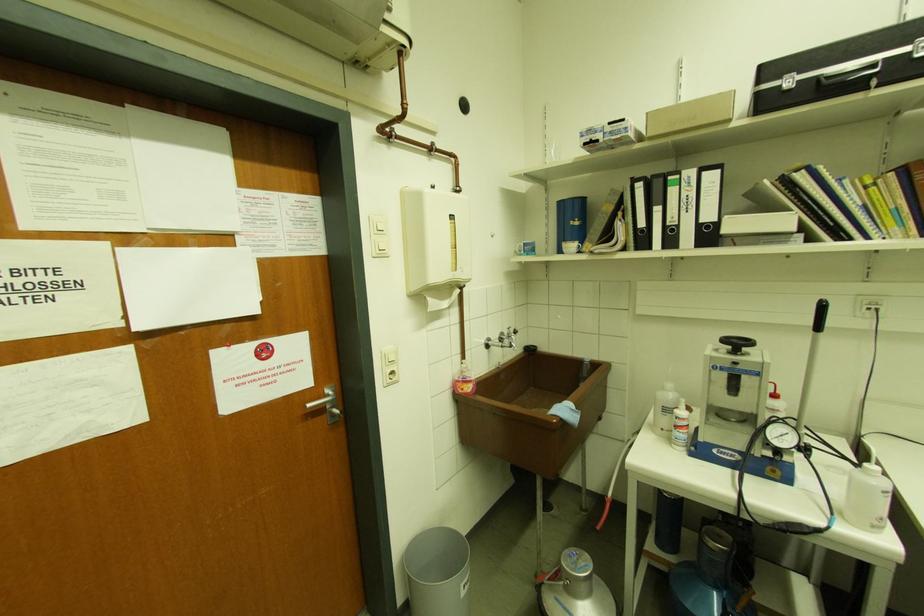
Image resolution: width=924 pixels, height=616 pixels. In order to click on silver door handle in this screenshot , I will do `click(320, 402)`.